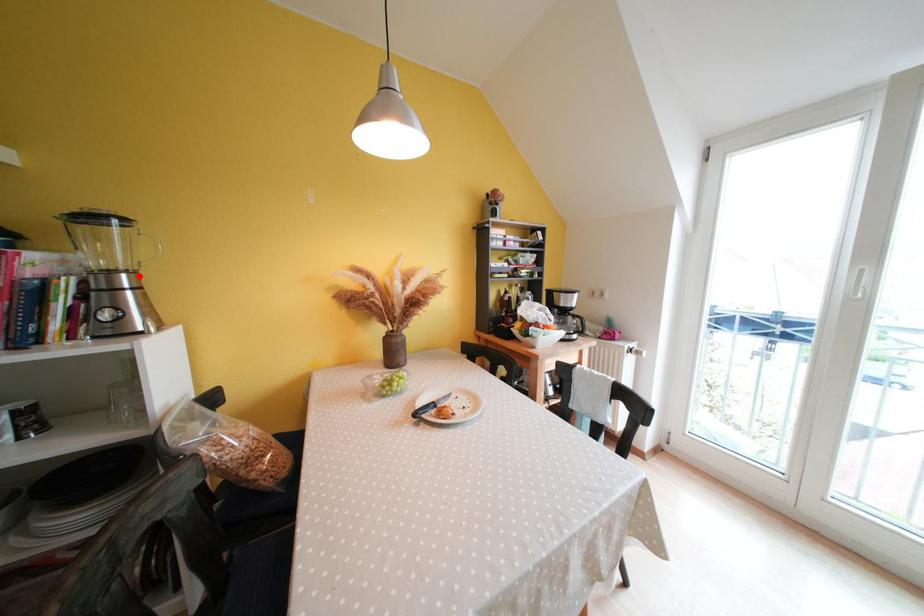
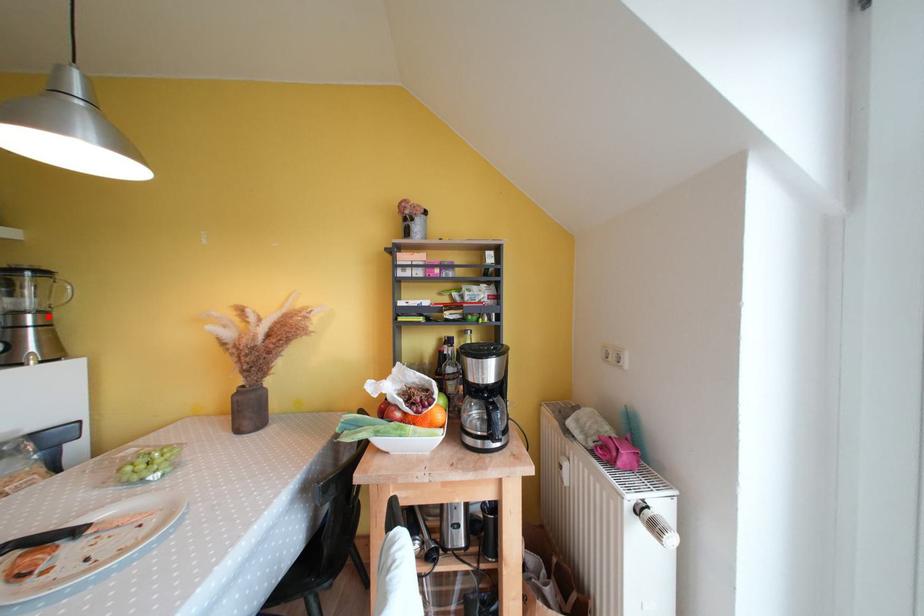
I am providing you with two images of the same scene from different viewpoints. A red point is marked on the first image and another point is marked on the second image. Are the points marked in image1 and image2 representing the same 3D position?

Yes